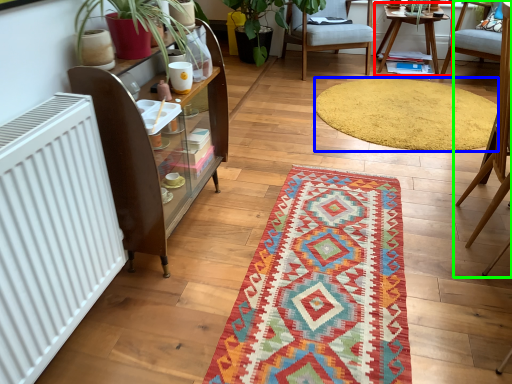
Question: Which object is the farthest from table (highlighted by a red box)? Choose among these: mat (highlighted by a blue box) or chair (highlighted by a green box).

Choices:
 (A) mat
 (B) chair

Answer: (B)